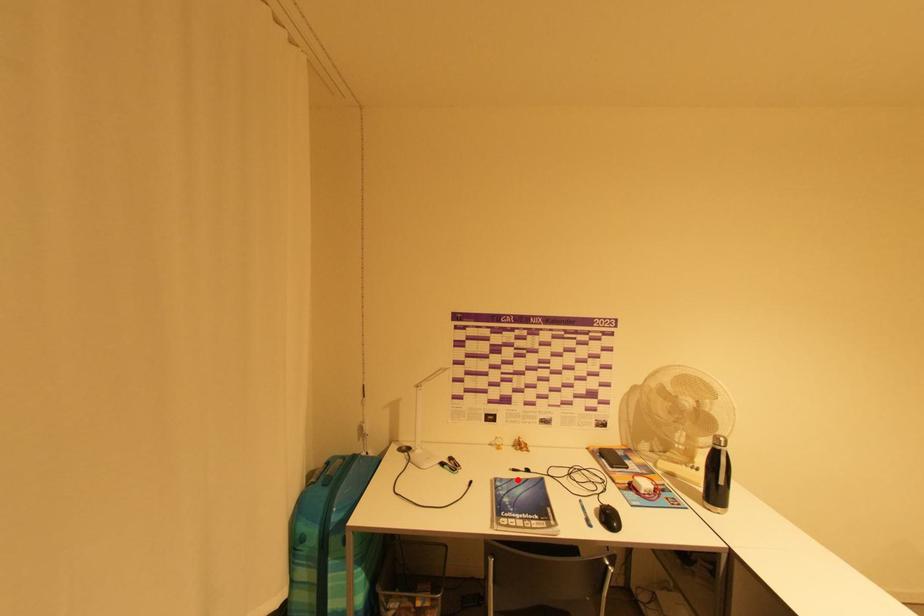
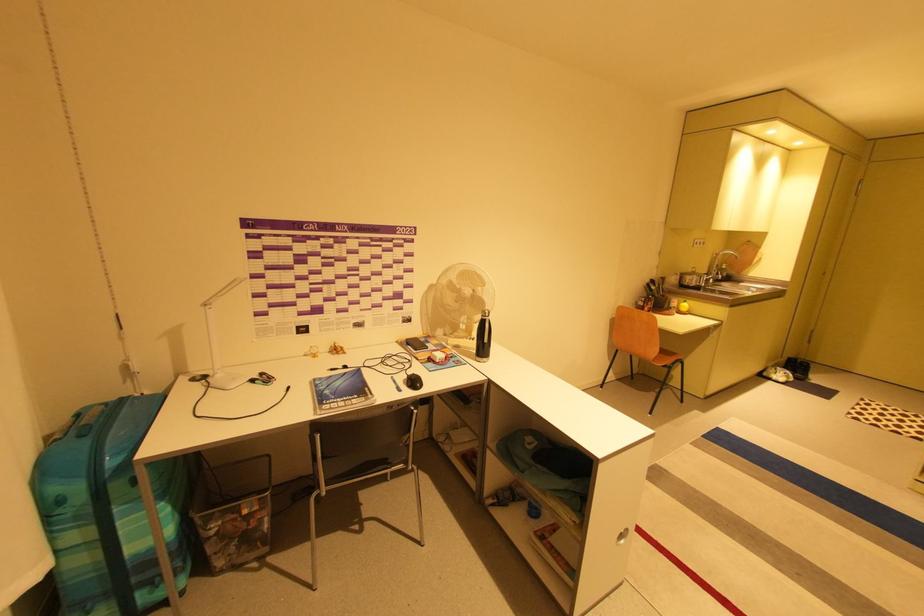
Where in the second image is the point corresponding to the highlighted location from the first image?

(336, 377)